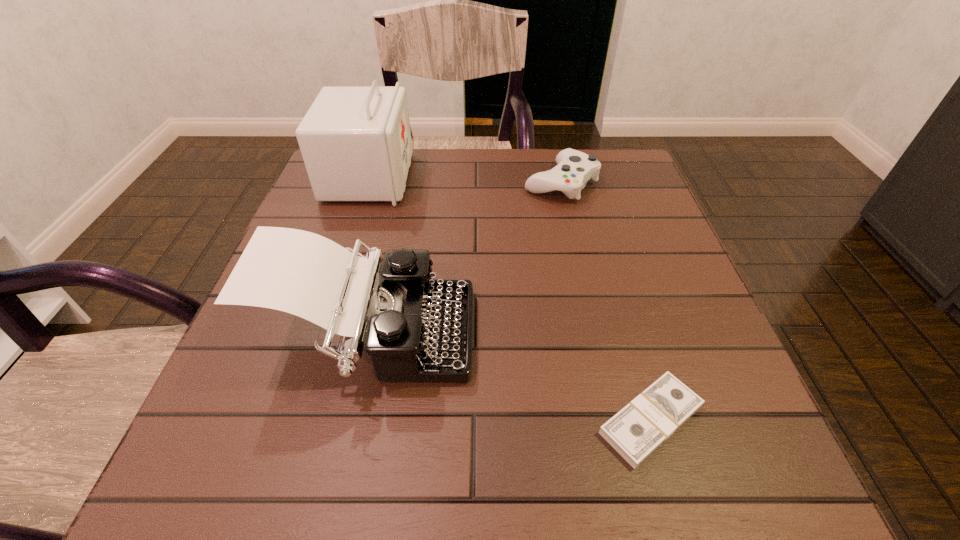
The width and height of the screenshot is (960, 540). Find the location of `vacant space at the right edge`. vacant space at the right edge is located at coordinates click(687, 268).

Where is `vacant space at the near left corner of the desktop`? Image resolution: width=960 pixels, height=540 pixels. vacant space at the near left corner of the desktop is located at coordinates (197, 462).

The height and width of the screenshot is (540, 960). I want to click on free point at the far right corner, so click(633, 201).

Locate an element on the screen. The image size is (960, 540). unoccupied area between the third tallest object and the shortest object is located at coordinates (606, 301).

Where is `vacant space that is in between the control and the shortest object`? The width and height of the screenshot is (960, 540). vacant space that is in between the control and the shortest object is located at coordinates (606, 301).

This screenshot has height=540, width=960. Find the location of `vacant area between the third tallest object and the tallest object`. vacant area between the third tallest object and the tallest object is located at coordinates (465, 180).

Image resolution: width=960 pixels, height=540 pixels. I want to click on free space between the second tallest object and the control, so click(467, 260).

The height and width of the screenshot is (540, 960). I want to click on vacant space that is in between the third shortest object and the shortest object, so click(512, 378).

Where is `free area in between the second shortest object and the shortest object`? free area in between the second shortest object and the shortest object is located at coordinates [x=606, y=301].

Find the location of `free space between the second shortest object and the shortest object`. free space between the second shortest object and the shortest object is located at coordinates (606, 301).